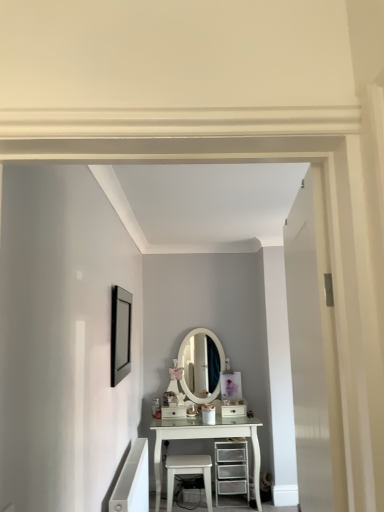
Find the location of a particular element. This screenshot has height=512, width=384. white glossy drawer at center, marked as the 2th drawer in a right-to-left arrangement is located at coordinates (173, 412).

This screenshot has height=512, width=384. Identify the location of white glossy stool at lower center. (188, 474).

Find the location of a particular element. This screenshot has width=384, height=512. white glossy drawer at center, marked as the 2th drawer in a right-to-left arrangement is located at coordinates (173, 412).

Is clear plastic drawers at center located within white matte door at right?

No, clear plastic drawers at center is located outside of white matte door at right.

Which is behind, white matte door at right or clear plastic drawers at center?

Positioned behind is clear plastic drawers at center.

Does white matte door at right have a lesser width compared to clear plastic drawers at center?

Indeed, white matte door at right has a lesser width compared to clear plastic drawers at center.

Based on the photo, which point is more forward, (303, 350) or (218, 476)?

Positioned in front is point (303, 350).

In the image, is white glossy drawer at center, marked as the first drawer in a left-to-right arrangement, on the left side or the right side of white glossy stool at lower center?

white glossy drawer at center, marked as the first drawer in a left-to-right arrangement, is positioned on white glossy stool at lower center's left side.

From a real-world perspective, between white glossy drawer at center, marked as the first drawer in a left-to-right arrangement, and white glossy stool at lower center, who is vertically lower?

In real-world perspective, white glossy stool at lower center is lower.

From the image's perspective, is white glossy drawer at center, marked as the first drawer in a left-to-right arrangement, over white glossy stool at lower center?

Yes.

Which of these two, white glossy drawer at center, marked as the 2th drawer in a right-to-left arrangement, or matte black picture frame at upper left, stands shorter?

Standing shorter between the two is white glossy drawer at center, marked as the 2th drawer in a right-to-left arrangement.

Is white glossy drawer at center, marked as the 2th drawer in a right-to-left arrangement, turned away from matte black picture frame at upper left?

That's not correct — white glossy drawer at center, marked as the 2th drawer in a right-to-left arrangement, is not looking away from matte black picture frame at upper left.

Is point (172, 413) positioned before point (119, 350)?

No.

Is matte black picture frame at upper left wider than white glossy drawer at center, which ranks as the 1th drawer in right-to-left order?

No, matte black picture frame at upper left is not wider than white glossy drawer at center, which ranks as the 1th drawer in right-to-left order.

From the image's perspective, relative to white glossy drawer at center, positioned as the 2th drawer in left-to-right order, is matte black picture frame at upper left above or below?

Based on their image positions, matte black picture frame at upper left is located above white glossy drawer at center, positioned as the 2th drawer in left-to-right order.

Is matte black picture frame at upper left shorter than white glossy drawer at center, positioned as the 2th drawer in left-to-right order?

In fact, matte black picture frame at upper left may be taller than white glossy drawer at center, positioned as the 2th drawer in left-to-right order.

Which is behind, matte black picture frame at upper left or white glossy drawer at center, which ranks as the 1th drawer in right-to-left order?

white glossy drawer at center, which ranks as the 1th drawer in right-to-left order, is further from the camera.

Is white glossy stool at lower center surrounded by white matte door at right?

Definitely not — white glossy stool at lower center is not inside white matte door at right.

Which object is positioned more to the right, white matte door at right or white glossy stool at lower center?

Positioned to the right is white matte door at right.

Is white glossy stool at lower center at the back of white matte door at right?

No, white glossy stool at lower center is not at the back of white matte door at right.

Which object is closer to the camera, white matte door at right or white glossy stool at lower center?

white matte door at right is more forward.

Is white glossy drawer at center, which ranks as the 1th drawer in right-to-left order, in contact with white glossy stool at lower center?

No.

Considering the sizes of objects white glossy drawer at center, which ranks as the 1th drawer in right-to-left order, and white glossy stool at lower center in the image provided, who is thinner, white glossy drawer at center, which ranks as the 1th drawer in right-to-left order, or white glossy stool at lower center?

white glossy drawer at center, which ranks as the 1th drawer in right-to-left order, is thinner.

You are a GUI agent. You are given a task and a screenshot of the screen. Output one action in this format:
    pyautogui.click(x=<x>, y=<y>)
    Task: Click on the drawer on the right of the white glossy stool at lower center
    This screenshot has height=512, width=384.
    Given the screenshot: What is the action you would take?
    pyautogui.click(x=234, y=411)

From the image's perspective, is white glossy drawer at center, positioned as the 2th drawer in left-to-right order, positioned above or below white glossy stool at lower center?

From the image's perspective, white glossy drawer at center, positioned as the 2th drawer in left-to-right order, appears above white glossy stool at lower center.

In the scene shown: Can you confirm if clear plastic drawers at center is thinner than matte black picture frame at upper left?

In fact, clear plastic drawers at center might be wider than matte black picture frame at upper left.

From the image's perspective, is clear plastic drawers at center located beneath matte black picture frame at upper left?

Yes, from the image's perspective, clear plastic drawers at center is below matte black picture frame at upper left.

Is clear plastic drawers at center inside the boundaries of matte black picture frame at upper left, or outside?

clear plastic drawers at center is not inside matte black picture frame at upper left, it's outside.

Locate an element on the screen. The width and height of the screenshot is (384, 512). door positioned vertically above the clear plastic drawers at center (from a real-world perspective) is located at coordinates (307, 352).

Locate an element on the screen. This screenshot has width=384, height=512. stool on the right of white glossy drawer at center, marked as the first drawer in a left-to-right arrangement is located at coordinates (188, 474).

From the image, which object appears to be nearer to clear plastic drawers at center, white matte door at right or matte black picture frame at upper left?

matte black picture frame at upper left lies closer to clear plastic drawers at center than the other object.

Based on their spatial positions, is white glossy drawer at center, positioned as the 2th drawer in left-to-right order, or white matte door at right further from clear plastic drawers at center?

Among the two, white matte door at right is located further to clear plastic drawers at center.

Which object lies nearer to the anchor point clear plastic drawers at center, matte black picture frame at upper left or white matte door at right?

matte black picture frame at upper left is positioned closer to the anchor clear plastic drawers at center.

Which object lies further to the anchor point white glossy drawer at center, which ranks as the 1th drawer in right-to-left order, white glossy drawer at center, marked as the 2th drawer in a right-to-left arrangement, or clear plastic drawers at center?

white glossy drawer at center, marked as the 2th drawer in a right-to-left arrangement.

Based on their spatial positions, is matte black picture frame at upper left or white glossy stool at lower center closer to white glossy drawer at center, marked as the 2th drawer in a right-to-left arrangement?

white glossy stool at lower center lies closer to white glossy drawer at center, marked as the 2th drawer in a right-to-left arrangement, than the other object.

Looking at the image, which one is located closer to white glossy stool at lower center, clear plastic drawers at center or white glossy drawer at center, marked as the first drawer in a left-to-right arrangement?

clear plastic drawers at center is closer to white glossy stool at lower center.

Looking at the image, which one is located further to white glossy drawer at center, marked as the 2th drawer in a right-to-left arrangement, white matte door at right or clear plastic drawers at center?

Based on the image, white matte door at right appears to be further to white glossy drawer at center, marked as the 2th drawer in a right-to-left arrangement.

From the image, which object appears to be farther from white glossy drawer at center, positioned as the 2th drawer in left-to-right order, white glossy drawer at center, marked as the first drawer in a left-to-right arrangement, or white matte door at right?

Based on the image, white matte door at right appears to be further to white glossy drawer at center, positioned as the 2th drawer in left-to-right order.

Where is `chest of drawers between matte black picture frame at upper left and white glossy drawer at center, marked as the 2th drawer in a right-to-left arrangement, from front to back`? chest of drawers between matte black picture frame at upper left and white glossy drawer at center, marked as the 2th drawer in a right-to-left arrangement, from front to back is located at coordinates (231, 468).

Identify the location of stool located between white matte door at right and white glossy drawer at center, positioned as the 2th drawer in left-to-right order, in the depth direction. tap(188, 474).

Image resolution: width=384 pixels, height=512 pixels. I want to click on chest of drawers between matte black picture frame at upper left and white glossy drawer at center, which ranks as the 1th drawer in right-to-left order, in the front-back direction, so click(231, 468).

Where is `the chest of drawers located between white matte door at right and white glossy drawer at center, which ranks as the 1th drawer in right-to-left order, in the depth direction`? the chest of drawers located between white matte door at right and white glossy drawer at center, which ranks as the 1th drawer in right-to-left order, in the depth direction is located at coordinates (231, 468).